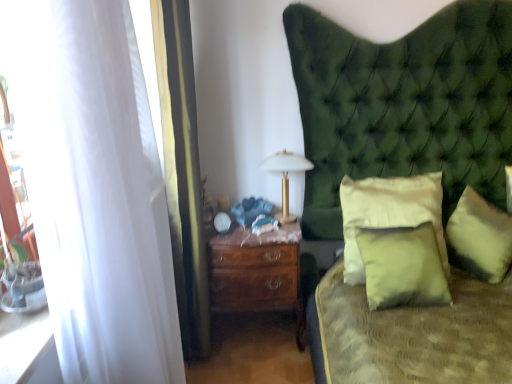
Question: Is point (189, 306) positioned closer to the camera than point (485, 201)?

Choices:
 (A) farther
 (B) closer

Answer: (B)

Question: Considering the positions of white sheer curtain at left, acting as the 2th curtain starting from the front, and soft yellow fabric pillow at right, acting as the third pillow starting from the left, in the image, is white sheer curtain at left, acting as the 2th curtain starting from the front, taller or shorter than soft yellow fabric pillow at right, acting as the third pillow starting from the left,?

Choices:
 (A) tall
 (B) short

Answer: (A)

Question: Estimate the real-world distances between objects in this image. Which object is farther from the soft yellow fabric pillow at right, which is the 1th pillow in right-to-left order?

Choices:
 (A) white sheer curtain at left, acting as the 2th curtain starting from the front
 (B) matte green pillow at center, marked as the third pillow in a right-to-left arrangement
 (C) white sheer curtain at left, which is the first curtain from front to back
 (D) gold metallic bedside lamp at center
 (E) mahogany wood nightstand at center

Answer: (C)

Question: Estimate the real-world distances between objects in this image. Which object is closer to the soft cream pillow at center, which appears as the 2th pillow when viewed from the right?

Choices:
 (A) soft yellow fabric pillow at right, acting as the third pillow starting from the left
 (B) mahogany wood nightstand at center
 (C) white sheer curtain at left, the first curtain in the back-to-front sequence
 (D) white sheer curtain at left, placed as the second curtain when sorted from back to front
 (E) gold metallic bedside lamp at center

Answer: (A)